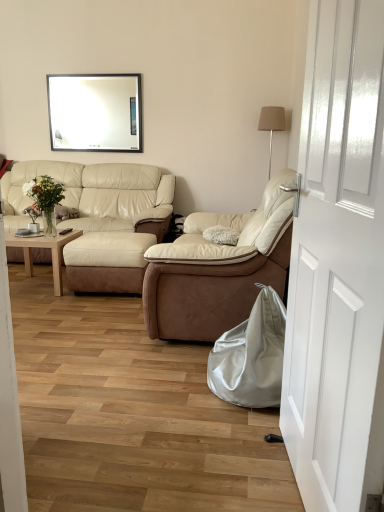
I want to click on white glossy mirror at upper center, so 95,112.

You are a GUI agent. You are given a task and a screenshot of the screen. Output one action in this format:
    pyautogui.click(x=<x>, y=<y>)
    Task: Click on the beige suede footrest at center
    
    Given the screenshot: What is the action you would take?
    pyautogui.click(x=107, y=262)

Locate an element on the screen. The width and height of the screenshot is (384, 512). white glossy door at center is located at coordinates (338, 264).

Describe the element at coordinates (101, 219) in the screenshot. I see `beige leather couch at center, acting as the first studio couch starting from the back` at that location.

Image resolution: width=384 pixels, height=512 pixels. I want to click on white glossy mirror at upper center, so click(95, 112).

Is white glossy mirror at upper center thinner than beige fabric lampshade at upper right?

Yes.

Is white glossy mirror at upper center facing away from beige fabric lampshade at upper right?

white glossy mirror at upper center is not turned away from beige fabric lampshade at upper right.

From a real-world perspective, between white glossy mirror at upper center and beige fabric lampshade at upper right, who is vertically lower?

beige fabric lampshade at upper right, from a real-world perspective.

Considering the sizes of objects light wood/finished coffee table at left and beige fabric lampshade at upper right in the image provided, who is smaller, light wood/finished coffee table at left or beige fabric lampshade at upper right?

With smaller size is beige fabric lampshade at upper right.

Considering the sizes of objects light wood/finished coffee table at left and beige fabric lampshade at upper right in the image provided, who is wider, light wood/finished coffee table at left or beige fabric lampshade at upper right?

light wood/finished coffee table at left.

Considering the relative sizes of light wood/finished coffee table at left and beige fabric lampshade at upper right in the image provided, is light wood/finished coffee table at left taller than beige fabric lampshade at upper right?

Incorrect, the height of light wood/finished coffee table at left is not larger of that of beige fabric lampshade at upper right.

Choose the correct answer: Is light wood/finished coffee table at left inside beige fabric lampshade at upper right or outside it?

light wood/finished coffee table at left exists outside the volume of beige fabric lampshade at upper right.

Is point (276, 112) positioned after point (176, 305)?

Yes, point (276, 112) is behind point (176, 305).

Which of these two, beige fabric lampshade at upper right or beige leather recliner at center, the 1th studio couch from the front, is thinner?

beige fabric lampshade at upper right.

Based on the photo, would you say beige fabric lampshade at upper right contains beige leather recliner at center, arranged as the 2th studio couch when viewed from the back?

Definitely not — beige leather recliner at center, arranged as the 2th studio couch when viewed from the back, is not inside beige fabric lampshade at upper right.

Is beige suede footrest at center behind white glossy door at center?

Yes, it is behind white glossy door at center.

From a real-world perspective, is beige suede footrest at center on white glossy door at center?

No, from a real-world perspective, beige suede footrest at center is not above white glossy door at center.

From the picture: Which object is positioned more to the left, beige suede footrest at center or white glossy door at center?

From the viewer's perspective, beige suede footrest at center appears more on the left side.

How much distance is there between beige suede footrest at center and white glossy door at center?

beige suede footrest at center is 2.19 meters from white glossy door at center.

Is beige leather recliner at center, which is the 2th studio couch from left to right, aimed at white glossy door at center?

No, beige leather recliner at center, which is the 2th studio couch from left to right, is not oriented towards white glossy door at center.

From the image's perspective, is beige leather recliner at center, the 1th studio couch from the front, located above white glossy door at center?

Yes, from the image's perspective, beige leather recliner at center, the 1th studio couch from the front, is on top of white glossy door at center.

Based on the photo, which of these two, beige leather recliner at center, arranged as the 2th studio couch when viewed from the back, or white glossy door at center, stands shorter?

Standing shorter between the two is beige leather recliner at center, arranged as the 2th studio couch when viewed from the back.

Is beige leather recliner at center, arranged as the 2th studio couch when viewed from the back, next to white glossy door at center and touching it?

beige leather recliner at center, arranged as the 2th studio couch when viewed from the back, and white glossy door at center are not in contact.

From a real-world perspective, which is physically below, white glossy door at center or white glossy mirror at upper center?

From a 3D spatial view, white glossy door at center is below.

Based on the photo, is white glossy door at center far away from white glossy mirror at upper center?

Yes.

Does point (379, 322) come in front of point (104, 93)?

Yes, point (379, 322) is in front of point (104, 93).

Looking at this image, is white glossy door at center at the right side of white glossy mirror at upper center?

Indeed, white glossy door at center is positioned on the right side of white glossy mirror at upper center.

From a real-world perspective, is beige leather recliner at center, the 1th studio couch in the right-to-left sequence, on satin silver bean bag at lower right?

Yes, from a real-world perspective, beige leather recliner at center, the 1th studio couch in the right-to-left sequence, is above satin silver bean bag at lower right.

In the scene shown: Is beige leather recliner at center, arranged as the 2th studio couch when viewed from the back, shorter than satin silver bean bag at lower right?

In fact, beige leather recliner at center, arranged as the 2th studio couch when viewed from the back, may be taller than satin silver bean bag at lower right.

Who is bigger, beige leather recliner at center, the 1th studio couch from the front, or satin silver bean bag at lower right?

Bigger between the two is beige leather recliner at center, the 1th studio couch from the front.

Would you say beige leather recliner at center, the 1th studio couch from the front, is outside satin silver bean bag at lower right?

That's correct, beige leather recliner at center, the 1th studio couch from the front, is outside of satin silver bean bag at lower right.

Where is `mirror positioned vertically above the beige fabric lampshade at upper right (from a real-world perspective)`? mirror positioned vertically above the beige fabric lampshade at upper right (from a real-world perspective) is located at coordinates (95, 112).

The height and width of the screenshot is (512, 384). I want to click on coffee table directly beneath the beige fabric lampshade at upper right (from a real-world perspective), so click(x=44, y=248).

Based on their spatial positions, is beige leather couch at center, acting as the first studio couch starting from the back, or light wood/finished coffee table at left closer to beige leather recliner at center, the 1th studio couch in the right-to-left sequence?

beige leather couch at center, acting as the first studio couch starting from the back, is closer to beige leather recliner at center, the 1th studio couch in the right-to-left sequence.

Considering their positions, is beige fabric lampshade at upper right positioned further to satin silver bean bag at lower right than white glossy door at center?

beige fabric lampshade at upper right is further to satin silver bean bag at lower right.

When comparing their distances from beige fabric lampshade at upper right, does beige leather couch at center, acting as the first studio couch starting from the back, or white glossy door at center seem closer?

beige leather couch at center, acting as the first studio couch starting from the back, is positioned closer to the anchor beige fabric lampshade at upper right.

Which object lies nearer to the anchor point beige leather recliner at center, the 1th studio couch from the front, beige suede footrest at center or satin silver bean bag at lower right?

The object closer to beige leather recliner at center, the 1th studio couch from the front, is satin silver bean bag at lower right.

Considering their positions, is beige leather couch at center, the second studio couch in the front-to-back sequence, positioned further to light wood/finished coffee table at left than white glossy mirror at upper center?

white glossy mirror at upper center.

From the picture: From the image, which object appears to be nearer to beige leather couch at center, the second studio couch in the front-to-back sequence, beige fabric lampshade at upper right or beige leather recliner at center, arranged as the 2th studio couch when viewed from the back?

beige leather recliner at center, arranged as the 2th studio couch when viewed from the back, is positioned closer to the anchor beige leather couch at center, the second studio couch in the front-to-back sequence.

Consider the image. When comparing their distances from satin silver bean bag at lower right, does beige fabric lampshade at upper right or beige leather recliner at center, arranged as the 2th studio couch when viewed from the back, seem further?

Among the two, beige fabric lampshade at upper right is located further to satin silver bean bag at lower right.

In the scene shown: From the image, which object appears to be nearer to white glossy mirror at upper center, beige leather recliner at center, which is the 2th studio couch from left to right, or white glossy door at center?

beige leather recliner at center, which is the 2th studio couch from left to right, is positioned closer to the anchor white glossy mirror at upper center.

Find the location of a particular element. The image size is (384, 512). mirror between light wood/finished coffee table at left and beige fabric lampshade at upper right from left to right is located at coordinates (95, 112).

Where is `material between white glossy door at center and light wood/finished coffee table at left along the z-axis`? material between white glossy door at center and light wood/finished coffee table at left along the z-axis is located at coordinates (251, 356).

In order to click on material between white glossy door at center and beige fabric lampshade at upper right in the front-back direction in this screenshot , I will do `click(251, 356)`.

Identify the location of material positioned between white glossy door at center and beige leather couch at center, the second studio couch in the front-to-back sequence, from near to far. (251, 356).